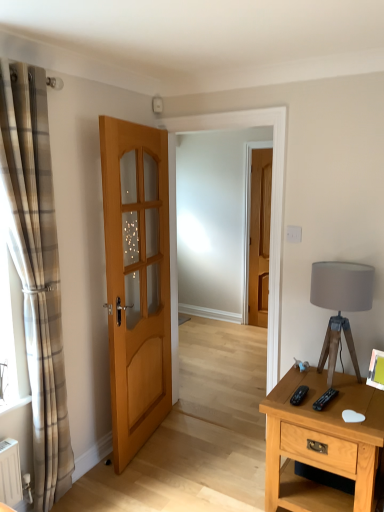
This screenshot has height=512, width=384. I want to click on free point above light brown wooden nightstand at right (from a real-world perspective), so click(332, 389).